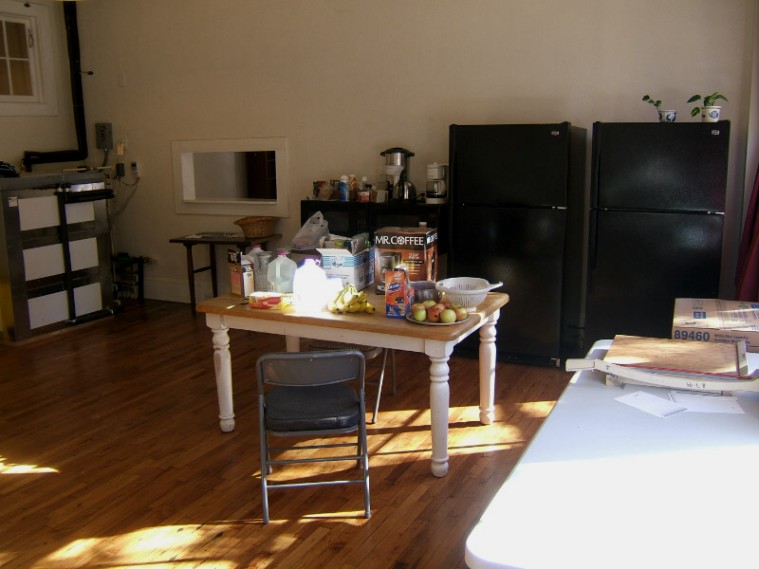
What are the coordinates of `wall` in the screenshot? It's located at (499, 53).